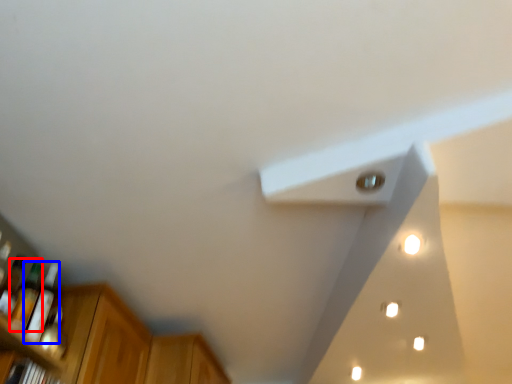
Question: Which object appears closest to the camera in this image, bottle (highlighted by a red box) or bottle (highlighted by a blue box)?

Choices:
 (A) bottle
 (B) bottle

Answer: (A)